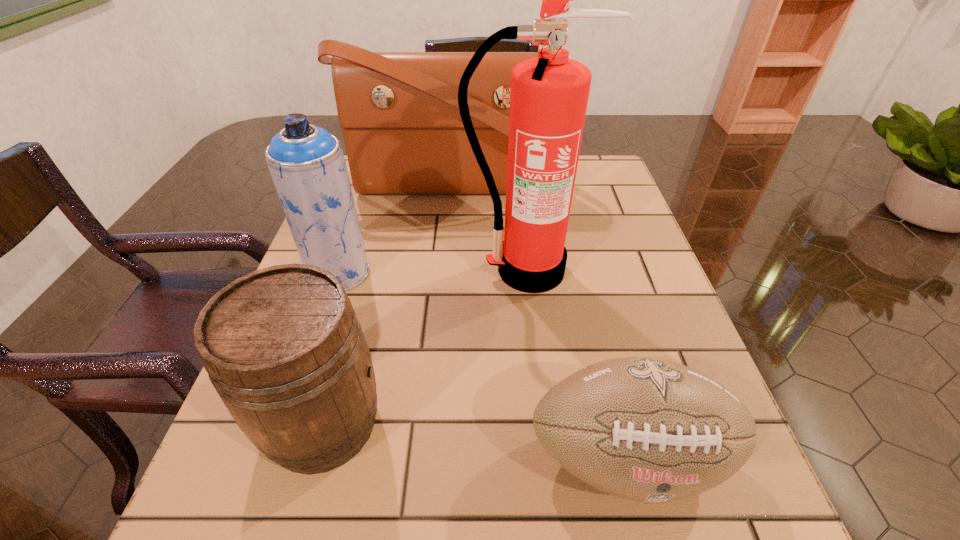
You are a GUI agent. You are given a task and a screenshot of the screen. Output one action in this format:
    pyautogui.click(x=<x>, y=<y>)
    Task: Click on the free space at the right edge of the desktop
    The height and width of the screenshot is (540, 960).
    Given the screenshot: What is the action you would take?
    pyautogui.click(x=650, y=326)

Find the location of `vacant space at the far right corner`. vacant space at the far right corner is located at coordinates (603, 171).

The image size is (960, 540). In order to click on vacant area that lies between the fire extinguisher and the football (American) in this screenshot , I will do `click(577, 364)`.

This screenshot has height=540, width=960. I want to click on free space that is in between the shortest object and the aerosol can, so click(x=483, y=365).

This screenshot has height=540, width=960. Identify the location of empty space between the fire extinguisher and the satchel. (491, 228).

Locate an element on the screen. The image size is (960, 540). vacant space in between the aerosol can and the farthest object is located at coordinates (396, 229).

The height and width of the screenshot is (540, 960). I want to click on free point between the farthest object and the aerosol can, so click(x=396, y=229).

Identify the location of vacant space that is in between the satchel and the football (American). (540, 321).

I want to click on free area in between the shortest object and the fire extinguisher, so click(577, 364).

What are the coordinates of `empty space between the farthest object and the football (American)` in the screenshot? It's located at (540, 321).